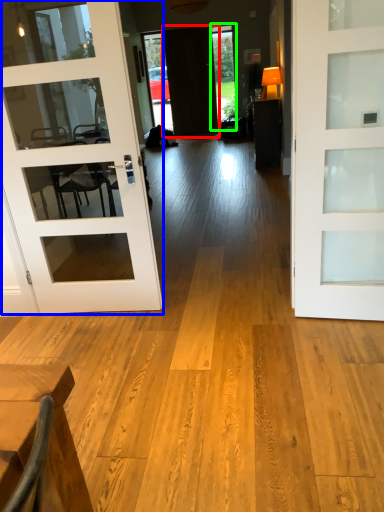
Question: Estimate the real-world distances between objects in this image. Which object is farther from door (highlighted by a red box), door (highlighted by a blue box) or window (highlighted by a green box)?

Choices:
 (A) door
 (B) window

Answer: (A)